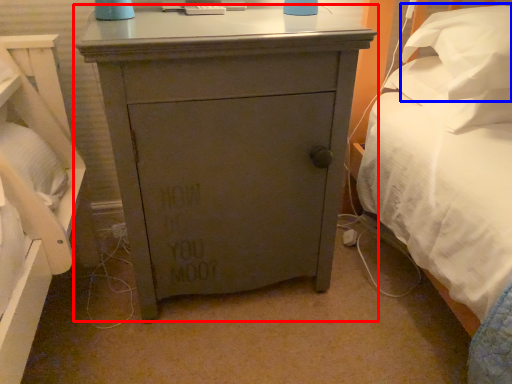
Question: Which point is further to the camera, chest of drawers (highlighted by a red box) or pillow (highlighted by a blue box)?

Choices:
 (A) chest of drawers
 (B) pillow

Answer: (B)